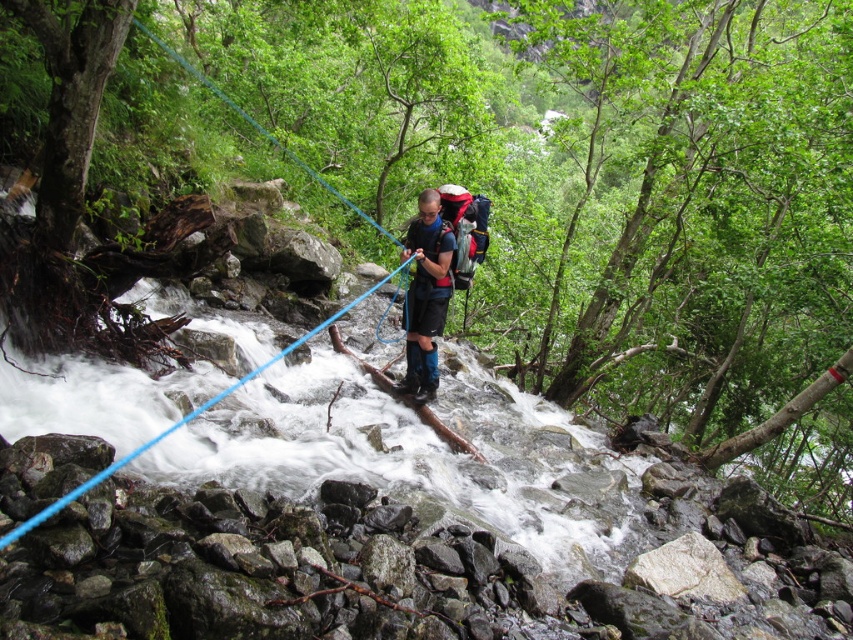
You are a hiker who just arrived at the stream and need to cross it safely. You see the matte black backpack at center and the blue synthetic rope at center. Which item is closer to you as you prepare to cross the stream?

The matte black backpack at center is closer to you than the blue synthetic rope at center because it is further to the viewer.

You are a hiker who needs to locate your matte black backpack at center. Based on the coordinates provided, where should you look relative to the stream?

The matte black backpack at center is located at coordinates point (425,296), which is near the center of the image. Since the stream is in the lower part of the image, the backpack is positioned above the stream.

You are an adventurer trying to cross the stream using the blue synthetic rope at center. Your matte black backpack at center is bulky. Will the backpack fit through the narrowest part of the bridge without getting stuck?

The matte black backpack at center is narrower than the blue synthetic rope at center, so it should fit through the narrowest part of the bridge without getting stuck.